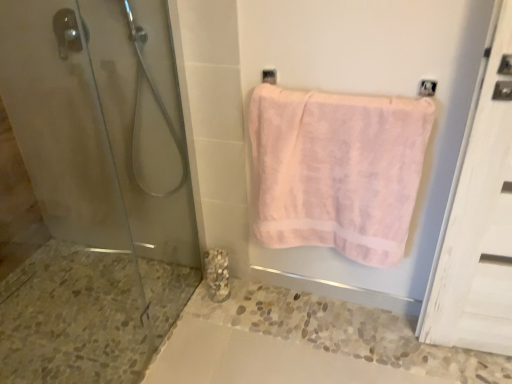
Question: From the image's perspective, is clear glass shower at left above or below matte silver towel bar at upper center?

Choices:
 (A) below
 (B) above

Answer: (A)

Question: Is clear glass shower at left inside or outside of matte silver towel bar at upper center?

Choices:
 (A) inside
 (B) outside

Answer: (B)

Question: Which of these objects is positioned farthest from the clear glass shower at left?

Choices:
 (A) transparent glass shower door at left
 (B) marble textured at lower left
 (C) pink fluffy towel at upper right
 (D) matte silver towel bar at upper center

Answer: (C)

Question: Based on their relative distances, which object is farther from the matte silver towel bar at upper center?

Choices:
 (A) marble textured at lower left
 (B) clear glass shower at left
 (C) pink fluffy towel at upper right
 (D) transparent glass shower door at left

Answer: (A)